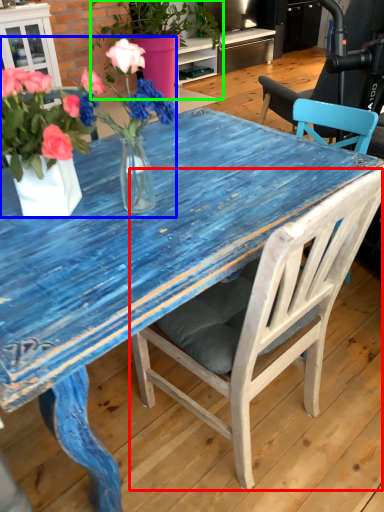
Question: Considering the real-world distances, which object is closest to chair (highlighted by a red box)? floral arrangement (highlighted by a blue box) or houseplant (highlighted by a green box).

Choices:
 (A) floral arrangement
 (B) houseplant

Answer: (A)